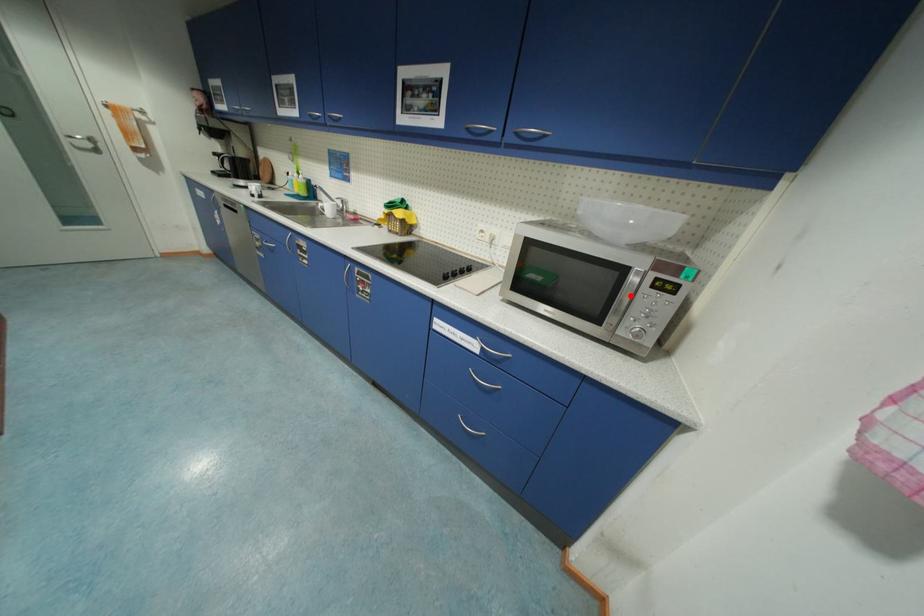
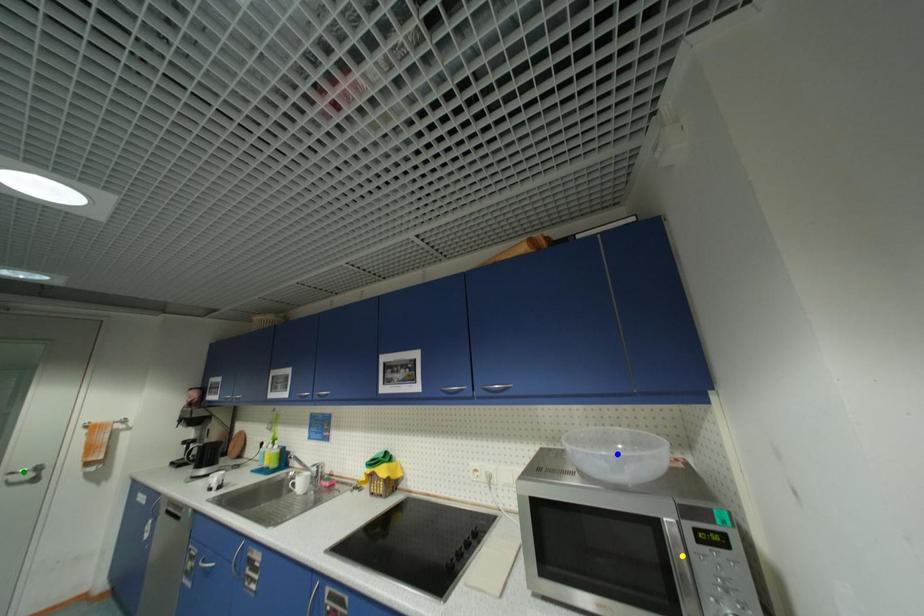
Question: I am providing you with two images of the same scene from different viewpoints. A red point is marked on the first image. You are given multiple points on the second image. Which point in image 2 represents the same 3d spot as the red point in image 1?

Choices:
 (A) blue point
 (B) green point
 (C) yellow point

Answer: (C)